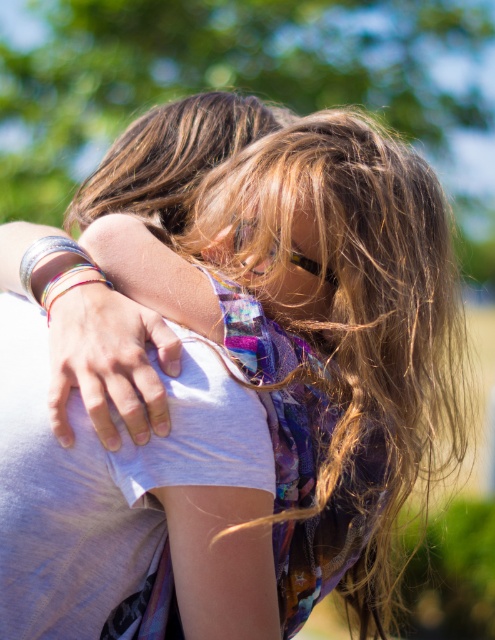
You are standing at the point marked by the coordinates point (91, 403) in the image. You want to take a photo of the two people embracing without moving. Can you do so without moving from your current position?

Yes, since the distance between you and the point (91, 403) is 1.24 meters, you can take the photo without moving.

You are a photographer trying to capture the metallic silver bracelet at upper left and the brown shiny hair at upper center in a closeup shot. Which object appears thinner in the photo?

The metallic silver bracelet at upper left appears thinner than the brown shiny hair at upper center in the photo.

You are a photographer preparing for a photoshoot and notice the metallic silver bracelet at upper left and the clear plastic goggles at center in the scene. Based on their sizes, which object would you need to adjust your camera focus more carefully to capture intricate details without blurring?

The metallic silver bracelet at upper left requires more careful focus adjustment because its width is larger than the clear plastic goggles at center, making it more likely to show blurring if not focused precisely.